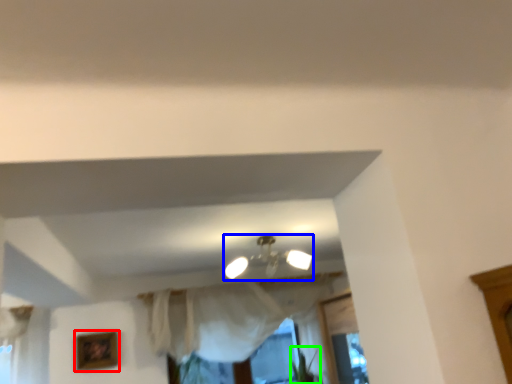
Question: Which is farther away from picture frame (highlighted by a red box)? lamp (highlighted by a blue box) or plant (highlighted by a green box)?

Choices:
 (A) lamp
 (B) plant

Answer: (B)